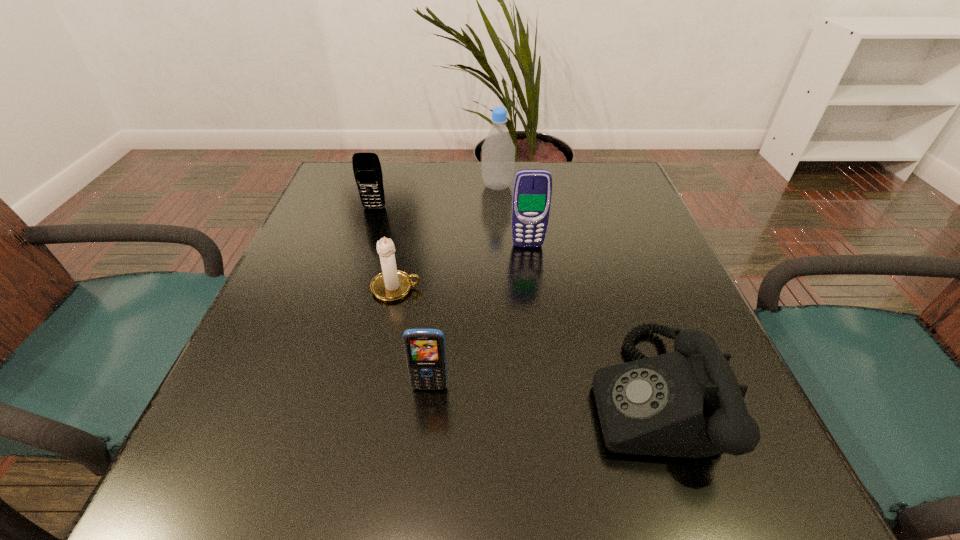
In order to click on object at the near edge in this screenshot , I will do `click(688, 403)`.

What are the coordinates of `object located at the left edge` in the screenshot? It's located at (367, 170).

Locate an element on the screen. This screenshot has height=540, width=960. object located at the right edge is located at coordinates (688, 403).

Locate an element on the screen. This screenshot has height=540, width=960. object at the far left corner is located at coordinates (367, 170).

This screenshot has height=540, width=960. I want to click on object at the near right corner, so click(688, 403).

Locate an element on the screen. The width and height of the screenshot is (960, 540). free region at the far edge is located at coordinates (394, 191).

Where is `vacant area at the near edge of the desktop`? This screenshot has width=960, height=540. vacant area at the near edge of the desktop is located at coordinates (535, 472).

Identify the location of vacant space at the left edge of the desktop. The image size is (960, 540). (336, 217).

Locate an element on the screen. free spot at the right edge of the desktop is located at coordinates [x=605, y=270].

The width and height of the screenshot is (960, 540). I want to click on free region at the far left corner, so click(x=346, y=160).